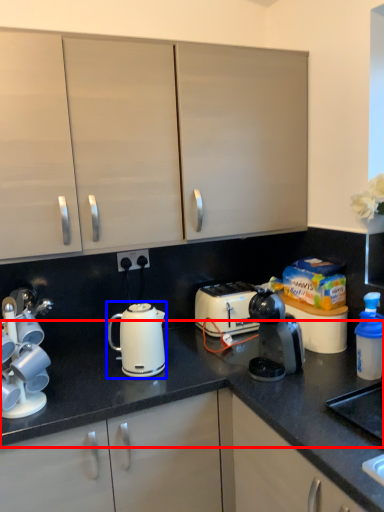
Question: Which object is further to the camera taking this photo, countertop (highlighted by a red box) or kettle (highlighted by a blue box)?

Choices:
 (A) countertop
 (B) kettle

Answer: (B)